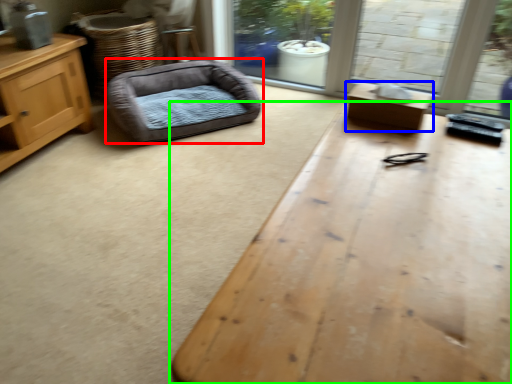
Question: Considering the real-world distances, which object is farthest from dog bed (highlighted by a red box)? table (highlighted by a blue box) or table (highlighted by a green box)?

Choices:
 (A) table
 (B) table

Answer: (B)